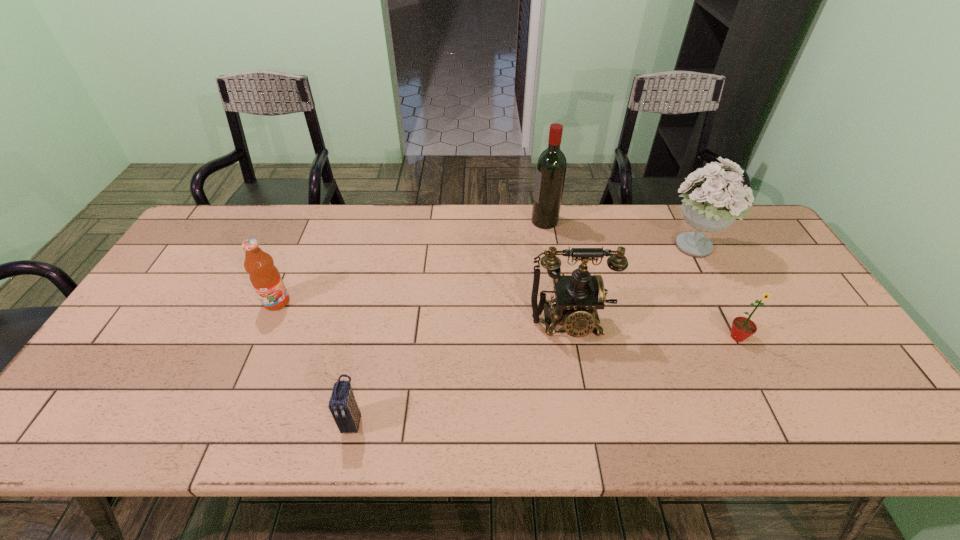
Where is `vacant area at the far edge`? The width and height of the screenshot is (960, 540). vacant area at the far edge is located at coordinates (633, 221).

The image size is (960, 540). In order to click on free space at the near edge in this screenshot , I will do `click(437, 437)`.

Find the location of `blank space at the left edge of the desktop`. blank space at the left edge of the desktop is located at coordinates (201, 266).

The height and width of the screenshot is (540, 960). In the image, there is a desktop. Find the location of `free space at the right edge`. free space at the right edge is located at coordinates (762, 261).

You are a GUI agent. You are given a task and a screenshot of the screen. Output one action in this format:
    pyautogui.click(x=<x>, y=<y>)
    Task: Click on the blank space at the far left corner of the desktop
    This screenshot has width=960, height=540.
    Given the screenshot: What is the action you would take?
    pyautogui.click(x=228, y=224)

In the image, there is a desktop. Identify the location of vacant space at the far right corner. The height and width of the screenshot is (540, 960). (741, 233).

You are a GUI agent. You are given a task and a screenshot of the screen. Output one action in this format:
    pyautogui.click(x=<x>, y=<y>)
    Task: Click on the free space that is in between the fifth tallest object and the clutch bag
    
    Given the screenshot: What is the action you would take?
    pyautogui.click(x=545, y=379)

Locate an element on the screen. The image size is (960, 540). free space between the fifth tallest object and the wine bottle is located at coordinates (641, 279).

Image resolution: width=960 pixels, height=540 pixels. In order to click on vacant space in between the sunflower and the third tallest object in this screenshot , I will do `click(653, 330)`.

I want to click on vacant area that lies between the fruit juice and the bouquet, so click(x=485, y=275).